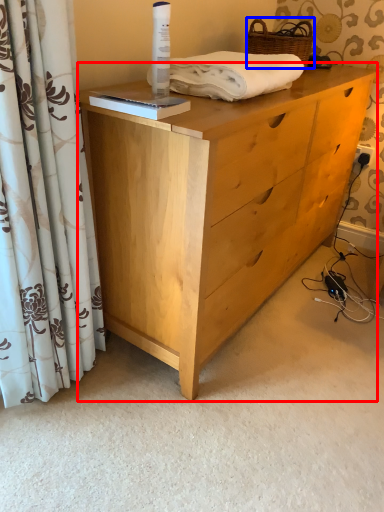
Question: Which of the following is the farthest to the observer, chest of drawers (highlighted by a red box) or basket (highlighted by a blue box)?

Choices:
 (A) chest of drawers
 (B) basket

Answer: (B)